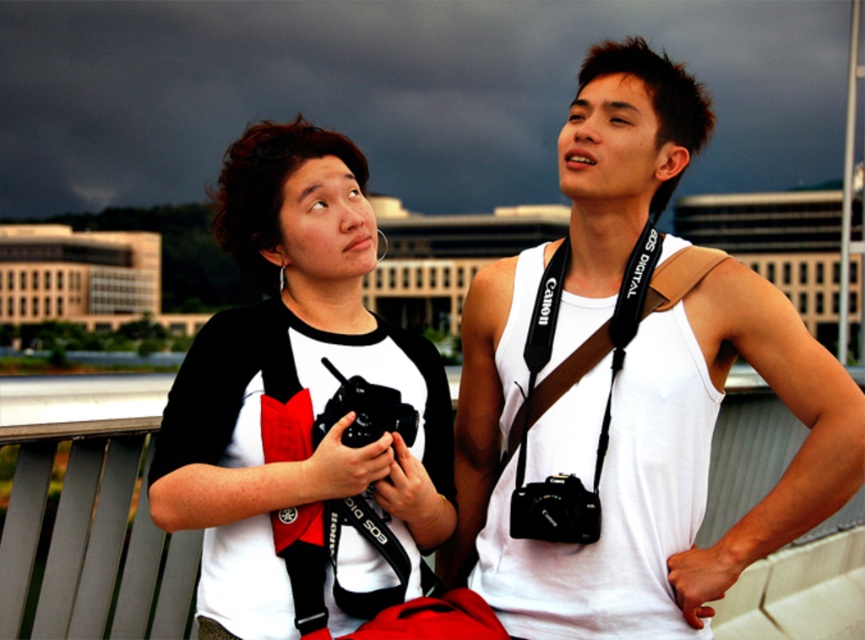
Consider the image. You are a photographer analyzing the scene. You notice a point at coordinates (293,381). What object is located at that point?

The point at coordinates (293,381) indicates the white matte black raglan shirt at upper left.